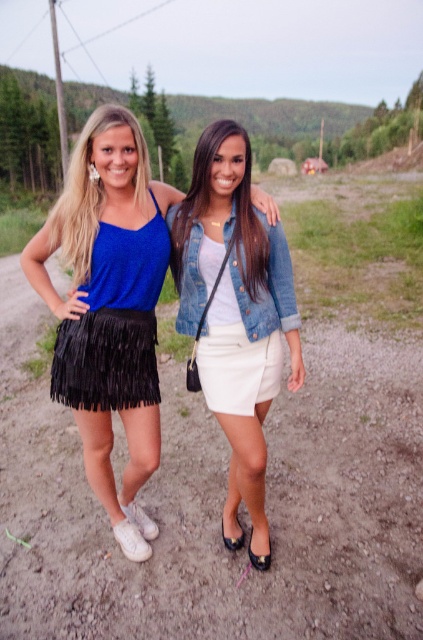
Question: Does black fringe skirt at left have a greater width compared to white matte skirt at center?

Choices:
 (A) yes
 (B) no

Answer: (A)

Question: Based on their relative distances, which object is nearer to the black fringe skirt at left?

Choices:
 (A) denim jacket at center
 (B) white matte skirt at center

Answer: (A)

Question: Does black fringe skirt at left appear under white matte skirt at center?

Choices:
 (A) no
 (B) yes

Answer: (A)

Question: Among these points, which one is farthest from the camera?

Choices:
 (A) (96, 406)
 (B) (159, 451)
 (C) (253, 282)
 (D) (242, 358)

Answer: (B)

Question: Is black fringed skirt at left positioned at the back of black fringe skirt at left?

Choices:
 (A) yes
 (B) no

Answer: (B)

Question: Which of the following is the closest to the observer?

Choices:
 (A) denim jacket at center
 (B) black fringed skirt at left
 (C) black fringe skirt at left

Answer: (A)